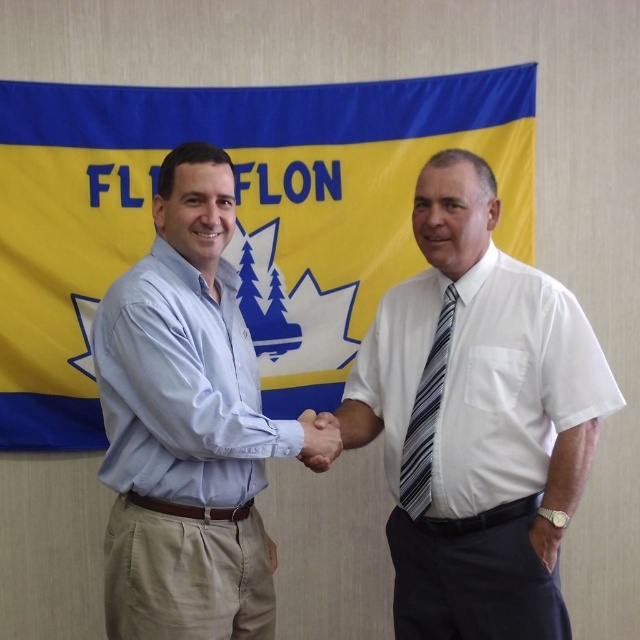
Question: Can you confirm if light blue shirt at center is thinner than smooth skin handshake at center?

Choices:
 (A) yes
 (B) no

Answer: (B)

Question: Among these points, which one is nearest to the camera?

Choices:
 (A) (413, 461)
 (B) (118, 404)
 (C) (472, 326)
 (D) (333, 445)

Answer: (B)

Question: Considering the real-world distances, which object is closest to the smooth skin handshake at center?

Choices:
 (A) light blue shirt at center
 (B) white striped tie at center

Answer: (A)

Question: Considering the relative positions of light blue shirt at center and smooth skin handshake at center in the image provided, where is light blue shirt at center located with respect to smooth skin handshake at center?

Choices:
 (A) above
 (B) below

Answer: (A)

Question: Does white striped tie at center have a lesser width compared to striped fabric tie at center?

Choices:
 (A) no
 (B) yes

Answer: (A)

Question: Which is farther from the light blue shirt at center?

Choices:
 (A) striped fabric tie at center
 (B) white striped tie at center
 (C) smooth skin handshake at center

Answer: (A)